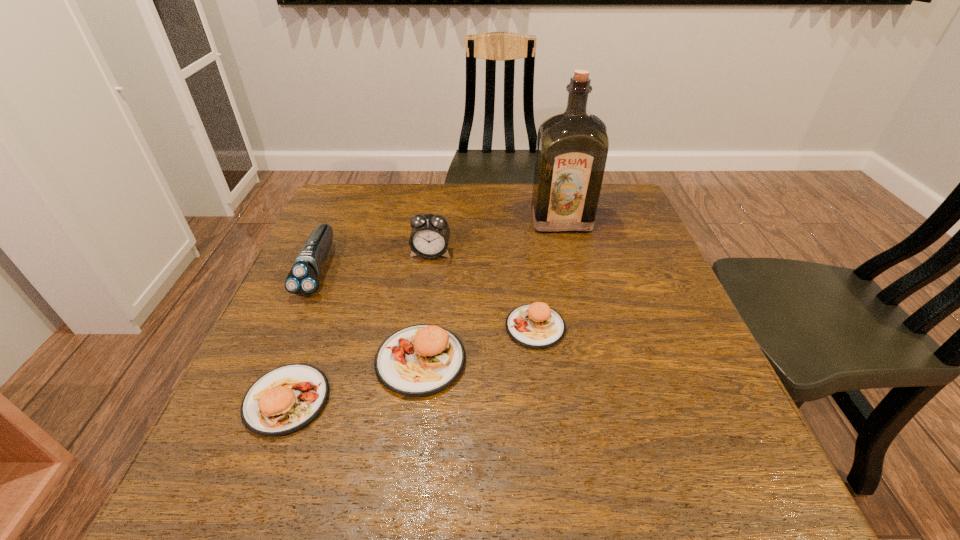
The pattys are evenly distributed in the image. To maintain this, where would you place another patty on the right? Please point to a free space. Please provide its 2D coordinates. Your answer should be formatted as a tuple, i.e. [(x, y)], where the tuple contains the x and y coordinates of a point satisfying the conditions above.

[(635, 298)]